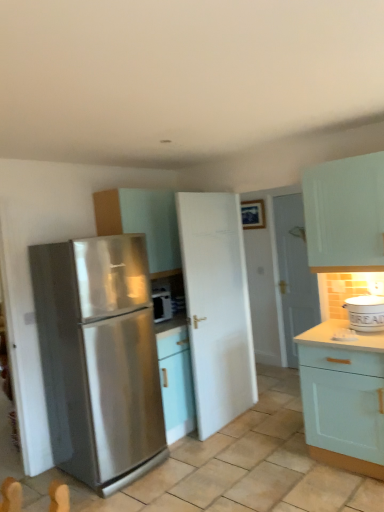
The height and width of the screenshot is (512, 384). In order to click on free space above light teal wood cabinet at lower right, marked as the first cabinetry in a front-to-back arrangement (from a real-world perspective) in this screenshot , I will do `click(340, 331)`.